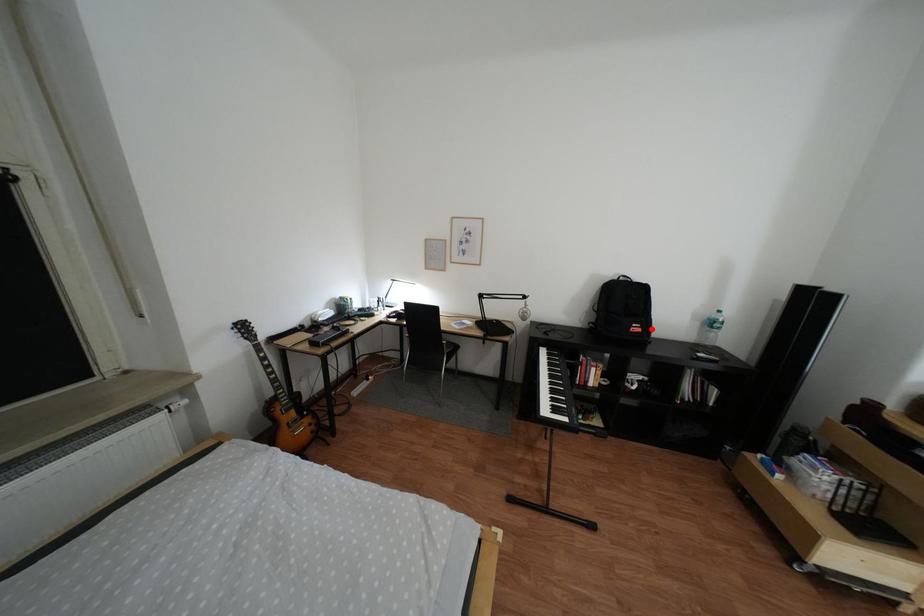
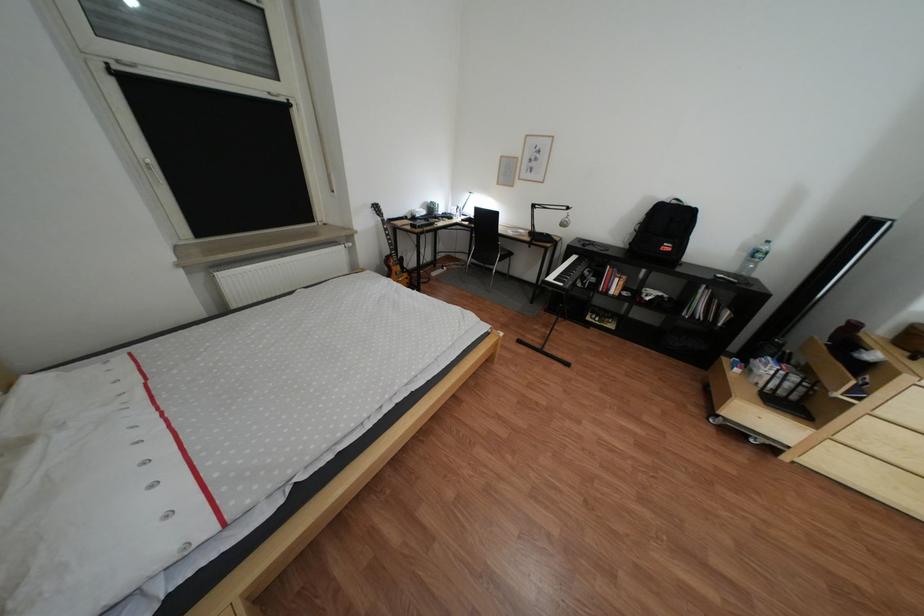
Find the pixel in the second image that matches the highlighted location in the first image.

(683, 248)